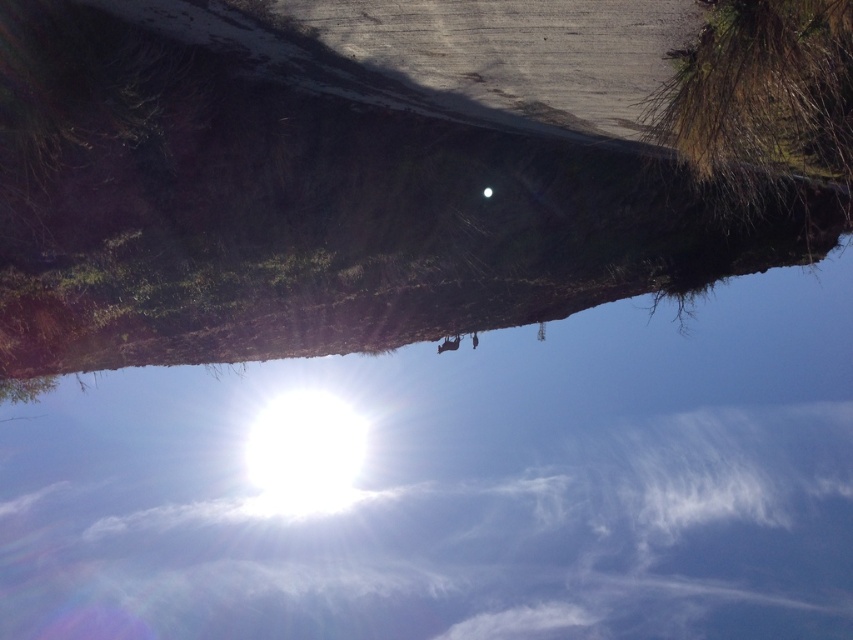
Who is taller, transparent glass water at upper center or green mossy tree at upper right?

transparent glass water at upper center

Is point (271, 456) positioned before point (712, 147)?

No, (271, 456) is behind (712, 147).

Who is more distant from viewer, (820, 394) or (776, 67)?

The point (820, 394) is more distant.

Find the location of a particular element. The width and height of the screenshot is (853, 640). transparent glass water at upper center is located at coordinates (459, 483).